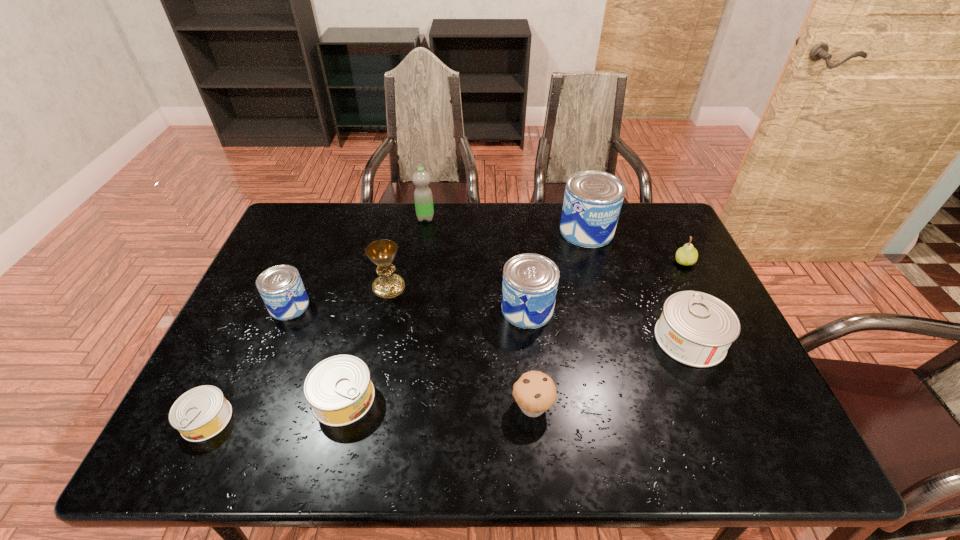
Locate an element on the screen. free area in between the rightmost can and the shortest object is located at coordinates [x=448, y=379].

The image size is (960, 540). Find the location of `vacant region between the biggest silver can and the shortest object`. vacant region between the biggest silver can and the shortest object is located at coordinates (448, 379).

Where is `empty location between the farthest blue can and the fifth tallest can`? The height and width of the screenshot is (540, 960). empty location between the farthest blue can and the fifth tallest can is located at coordinates (466, 314).

This screenshot has height=540, width=960. In order to click on free space between the pear and the farthest blue can in this screenshot , I will do `click(636, 246)`.

Where is `free point between the smallest blue can and the rightmost silver can`? free point between the smallest blue can and the rightmost silver can is located at coordinates (490, 322).

Where is `unoccupied area between the second blue can from right to left and the muffin`? The image size is (960, 540). unoccupied area between the second blue can from right to left and the muffin is located at coordinates (530, 357).

Find the location of a particular element. The width and height of the screenshot is (960, 540). vacant space in between the green water bottle and the farthest blue can is located at coordinates (506, 224).

Locate which object ranks fourth in proximity to the green water bottle. Please provide its 2D coordinates. Your answer should be formatted as a tuple, i.e. [(x, y)], where the tuple contains the x and y coordinates of a point satisfying the conditions above.

[(593, 199)]

Locate which object is the ninth closest to the third can from left to right. Please provide its 2D coordinates. Your answer should be formatted as a tuple, i.e. [(x, y)], where the tuple contains the x and y coordinates of a point satisfying the conditions above.

[(687, 255)]

You are a GUI agent. You are given a task and a screenshot of the screen. Output one action in this format:
    pyautogui.click(x=<x>, y=<y>)
    Task: Click on the can that stands as the third closest to the leftmost blue can
    This screenshot has width=960, height=540.
    Given the screenshot: What is the action you would take?
    pyautogui.click(x=530, y=281)